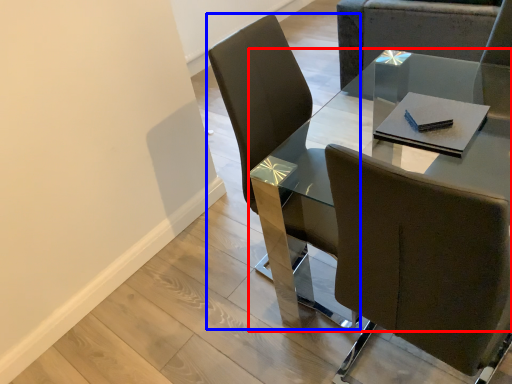
Question: Among these objects, which one is nearest to the camera, table (highlighted by a red box) or chair (highlighted by a blue box)?

Choices:
 (A) table
 (B) chair

Answer: (A)